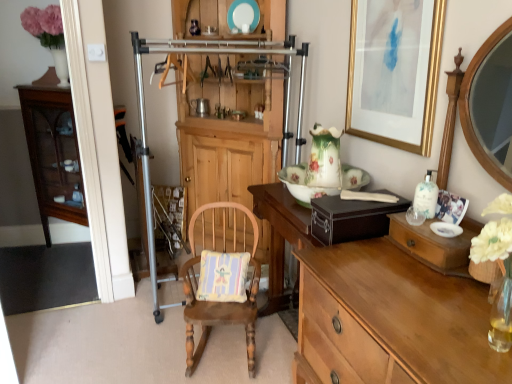
In order to click on vacant space in front of mahogany glass-front cabinet at left, which ranks as the first cabinetry in left-to-right order in this screenshot , I will do `click(45, 283)`.